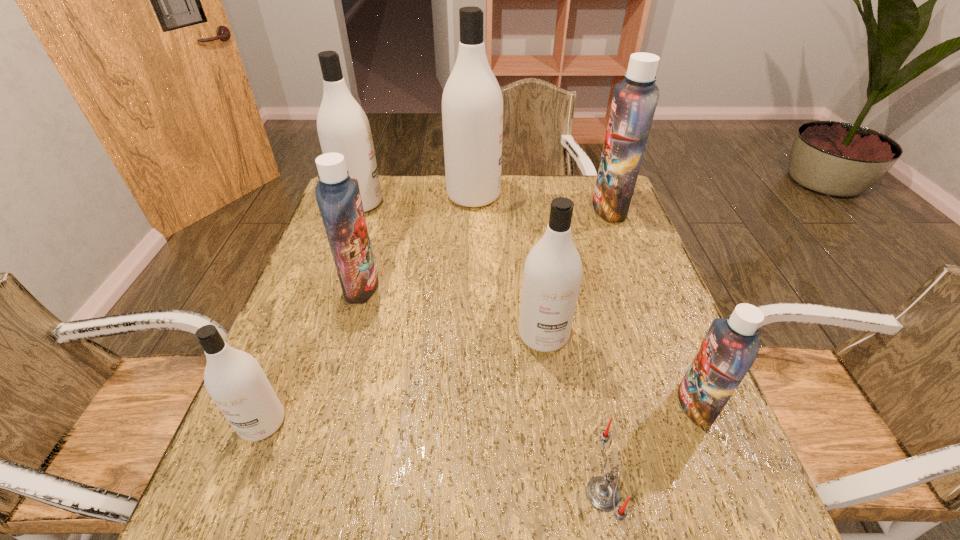
Locate an element on the screen. the fourth object from left to right is located at coordinates (472, 102).

Locate an element on the screen. The width and height of the screenshot is (960, 540). the second white shampoo from right to left is located at coordinates (472, 102).

Locate an element on the screen. the third smallest white shampoo is located at coordinates tap(343, 127).

Locate an element on the screen. The image size is (960, 540). the farthest blue shampoo is located at coordinates (634, 102).

Where is `the fourth farthest shampoo`? The height and width of the screenshot is (540, 960). the fourth farthest shampoo is located at coordinates (338, 197).

Find the location of a particular element. The image size is (960, 540). the second nearest blue shampoo is located at coordinates (338, 197).

At what (x,y) coordinates should I click in order to perform the action: click on the rightmost white shampoo. Please return your answer as a coordinate pair (x, y). This screenshot has width=960, height=540. Looking at the image, I should click on (552, 274).

At what (x,y) coordinates should I click in order to perform the action: click on the fifth shampoo from left to right. Please return your answer as a coordinate pair (x, y). Looking at the image, I should click on (552, 274).

This screenshot has height=540, width=960. What are the coordinates of `the smallest blue shampoo` in the screenshot? It's located at (731, 345).

You are a GUI agent. You are given a task and a screenshot of the screen. Output one action in this format:
    pyautogui.click(x=<x>, y=<y>)
    Task: Click on the smallest white shampoo
    
    Given the screenshot: What is the action you would take?
    pyautogui.click(x=234, y=379)